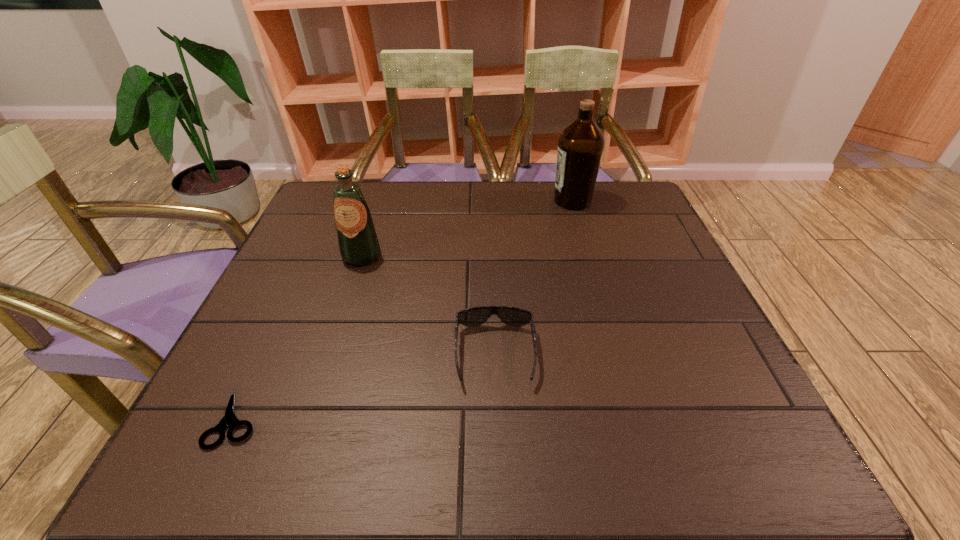
What are the coordinates of `object located at the far right corner` in the screenshot? It's located at (581, 144).

Where is `vacant space at the far edge of the desktop`? vacant space at the far edge of the desktop is located at coordinates (463, 223).

Locate an element on the screen. The image size is (960, 540). vacant space at the near edge is located at coordinates (534, 456).

This screenshot has width=960, height=540. Find the location of `vacant space at the left edge of the desktop`. vacant space at the left edge of the desktop is located at coordinates (269, 338).

This screenshot has width=960, height=540. I want to click on vacant space at the right edge of the desktop, so click(x=639, y=247).

Where is `free region at the far right corner of the desktop`? free region at the far right corner of the desktop is located at coordinates (601, 220).

Identify the location of vacant area between the shears and the taller olive oil. The width and height of the screenshot is (960, 540). (404, 309).

Where is `free space between the shears and the rightmost object`? This screenshot has width=960, height=540. free space between the shears and the rightmost object is located at coordinates (404, 309).

Where is `free space between the sunglasses and the taller olive oil`? free space between the sunglasses and the taller olive oil is located at coordinates (534, 278).

The width and height of the screenshot is (960, 540). In order to click on free space between the farther olive oil and the left olive oil in this screenshot , I will do `click(467, 228)`.